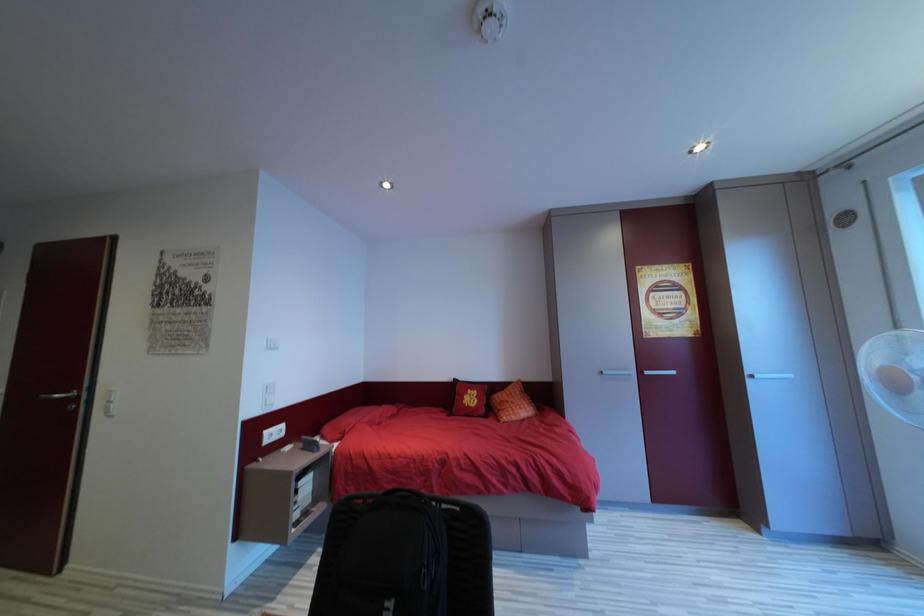
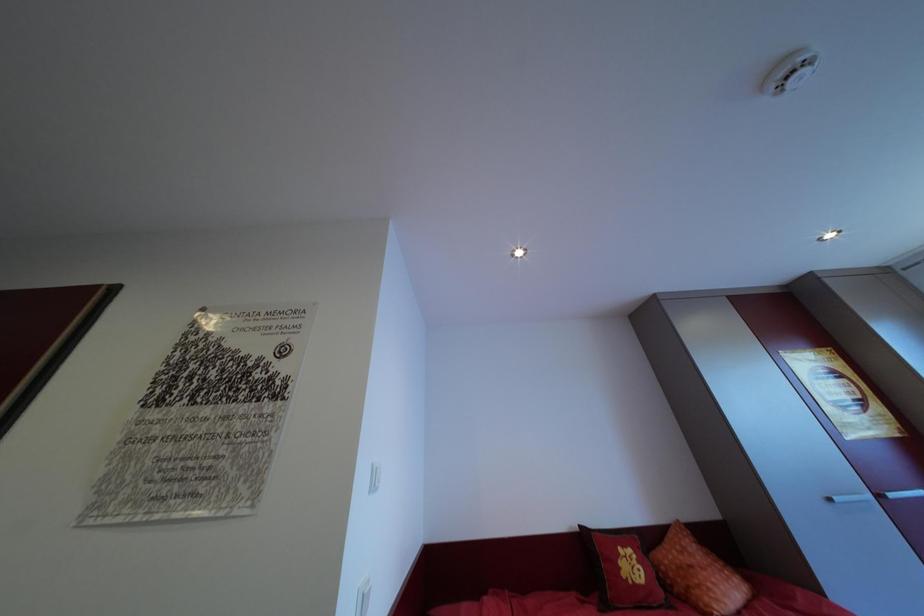
What movement of the cameraman would produce the second image?

The movement direction of the cameraman is left, forward.